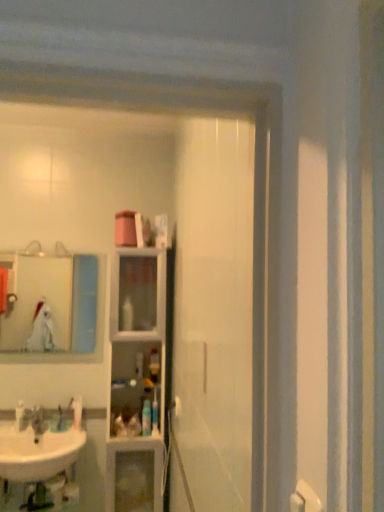
Question: In which direction should I rotate to look at white glossy toothpaste tube at center, the 4th toiletry when ordered from right to left?

Choices:
 (A) left
 (B) right

Answer: (A)

Question: Which direction should I rotate to look at translucent plastic bottle at center, the first toiletry viewed from the right?

Choices:
 (A) left
 (B) right

Answer: (A)

Question: Is brushed metal faucet at lower left next to matte glass mirror at upper left and touching it?

Choices:
 (A) no
 (B) yes

Answer: (A)

Question: Is brushed metal faucet at lower left oriented towards matte glass mirror at upper left?

Choices:
 (A) yes
 (B) no

Answer: (B)

Question: Can you confirm if brushed metal faucet at lower left is shorter than matte glass mirror at upper left?

Choices:
 (A) yes
 (B) no

Answer: (A)

Question: Considering the relative sizes of brushed metal faucet at lower left and matte glass mirror at upper left in the image provided, is brushed metal faucet at lower left thinner than matte glass mirror at upper left?

Choices:
 (A) no
 (B) yes

Answer: (A)

Question: Considering the relative positions of brushed metal faucet at lower left and matte glass mirror at upper left in the image provided, is brushed metal faucet at lower left to the right of matte glass mirror at upper left from the viewer's perspective?

Choices:
 (A) no
 (B) yes

Answer: (A)

Question: From a real-world perspective, is brushed metal faucet at lower left positioned over matte glass mirror at upper left based on gravity?

Choices:
 (A) no
 (B) yes

Answer: (A)

Question: Considering the relative sizes of white glossy toothpaste tube at center, the second toiletry from the left, and white glossy sink at lower left in the image provided, is white glossy toothpaste tube at center, the second toiletry from the left, taller than white glossy sink at lower left?

Choices:
 (A) yes
 (B) no

Answer: (B)

Question: Considering the relative positions of white glossy toothpaste tube at center, the second toiletry from the left, and white glossy sink at lower left in the image provided, is white glossy toothpaste tube at center, the second toiletry from the left, to the right of white glossy sink at lower left from the viewer's perspective?

Choices:
 (A) no
 (B) yes

Answer: (B)

Question: Considering the relative sizes of white glossy toothpaste tube at center, the second toiletry from the left, and white glossy sink at lower left in the image provided, is white glossy toothpaste tube at center, the second toiletry from the left, smaller than white glossy sink at lower left?

Choices:
 (A) yes
 (B) no

Answer: (A)

Question: Can you confirm if white glossy toothpaste tube at center, the 4th toiletry when ordered from right to left, is shorter than white glossy sink at lower left?

Choices:
 (A) no
 (B) yes

Answer: (B)

Question: Considering the relative positions of white glossy toothpaste tube at center, the 4th toiletry when ordered from right to left, and white glossy sink at lower left in the image provided, is white glossy toothpaste tube at center, the 4th toiletry when ordered from right to left, in front of white glossy sink at lower left?

Choices:
 (A) yes
 (B) no

Answer: (B)

Question: Is white glossy sink at lower left a part of white glossy toothpaste tube at center, the second toiletry from the left?

Choices:
 (A) yes
 (B) no

Answer: (B)

Question: Is there a large distance between clear glass cabinet at center and white glossy sink at lower left?

Choices:
 (A) yes
 (B) no

Answer: (B)